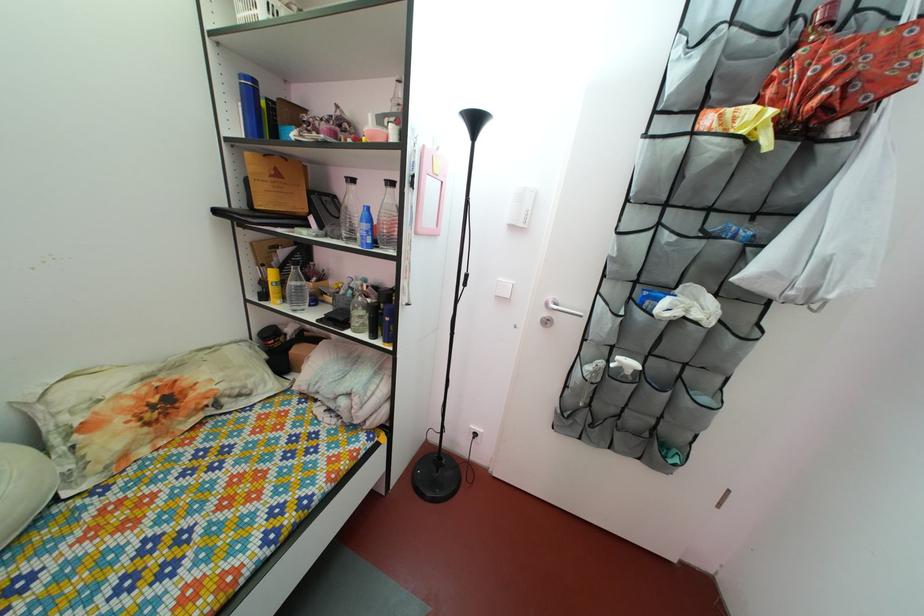
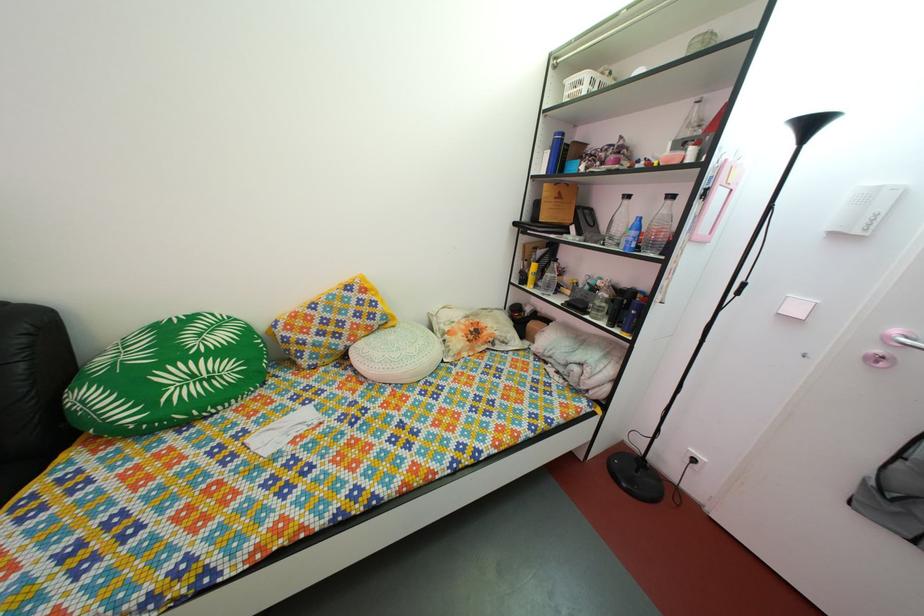
Question: How did the camera likely rotate?

Choices:
 (A) Left
 (B) Right
 (C) Up
 (D) Down

Answer: (A)